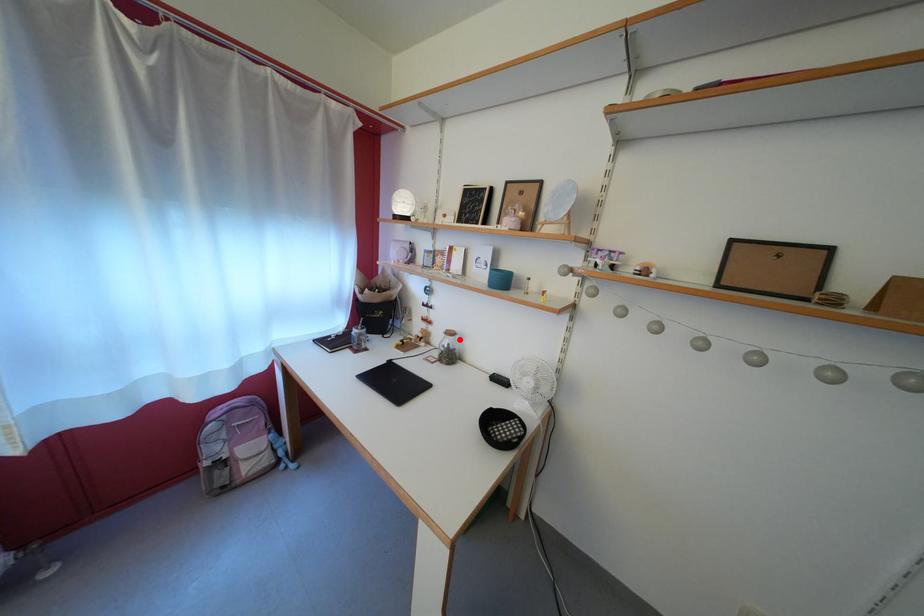
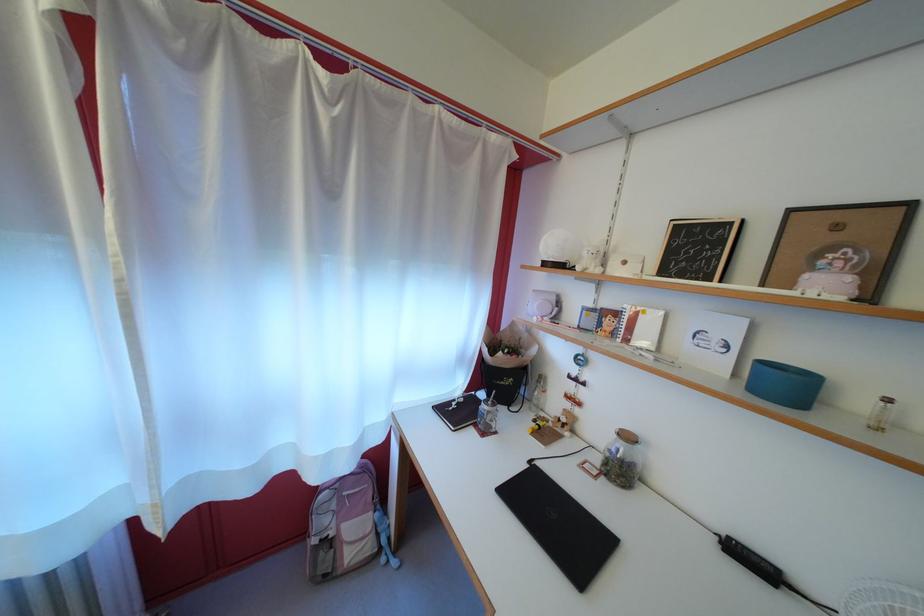
Where in the second image is the point corresponding to the highlighted location from the first image?

(637, 444)